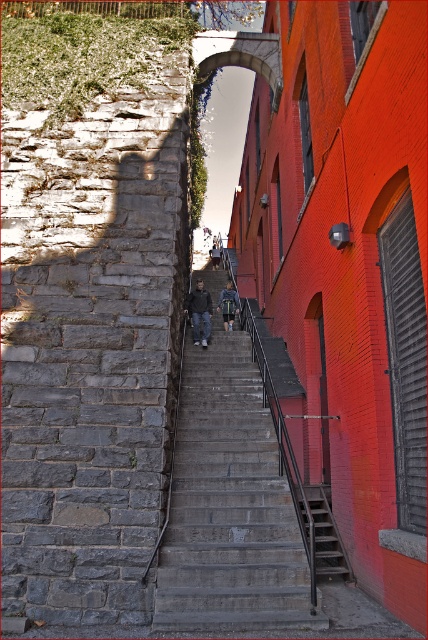
Is metallic gray stairs at center further to camera compared to dark gray jeans at center?

No, metallic gray stairs at center is closer to the viewer.

Is point (324, 522) closer to camera compared to point (211, 262)?

Yes, point (324, 522) is closer to viewer.

Find the location of `metallic gray stairs at center`. metallic gray stairs at center is located at coordinates (323, 536).

Does point (333, 541) come behind point (216, 307)?

No, (333, 541) is closer to viewer.

Is metallic gray stairs at center to the right of denim jacket at center from the viewer's perspective?

Indeed, metallic gray stairs at center is positioned on the right side of denim jacket at center.

Which is in front, point (329, 570) or point (223, 316)?

Point (329, 570) is more forward.

This screenshot has width=428, height=640. What are the coordinates of `metallic gray stairs at center` in the screenshot? It's located at (323, 536).

Does metallic gray stairs at center have a larger size compared to dark gray fabric jacket at center?

Correct, metallic gray stairs at center is larger in size than dark gray fabric jacket at center.

Which is below, metallic gray stairs at center or dark gray fabric jacket at center?

metallic gray stairs at center

This screenshot has height=640, width=428. Identify the location of metallic gray stairs at center. (323, 536).